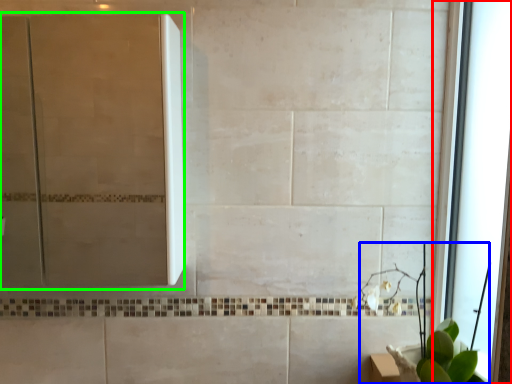
Question: Considering the real-world distances, which object is closest to window (highlighted by a red box)? plant (highlighted by a blue box) or screen door (highlighted by a green box).

Choices:
 (A) plant
 (B) screen door

Answer: (A)